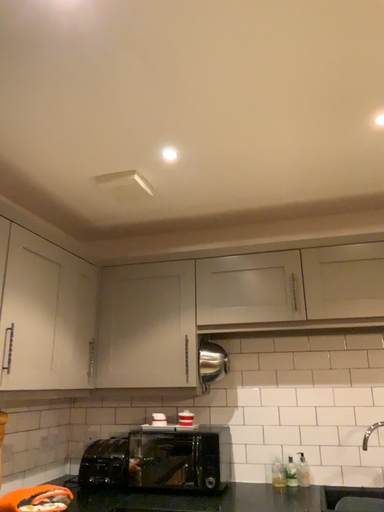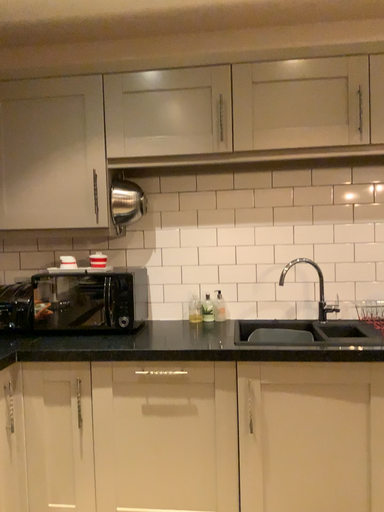
Question: Which way did the camera rotate in the video?

Choices:
 (A) rotated left
 (B) rotated right

Answer: (B)